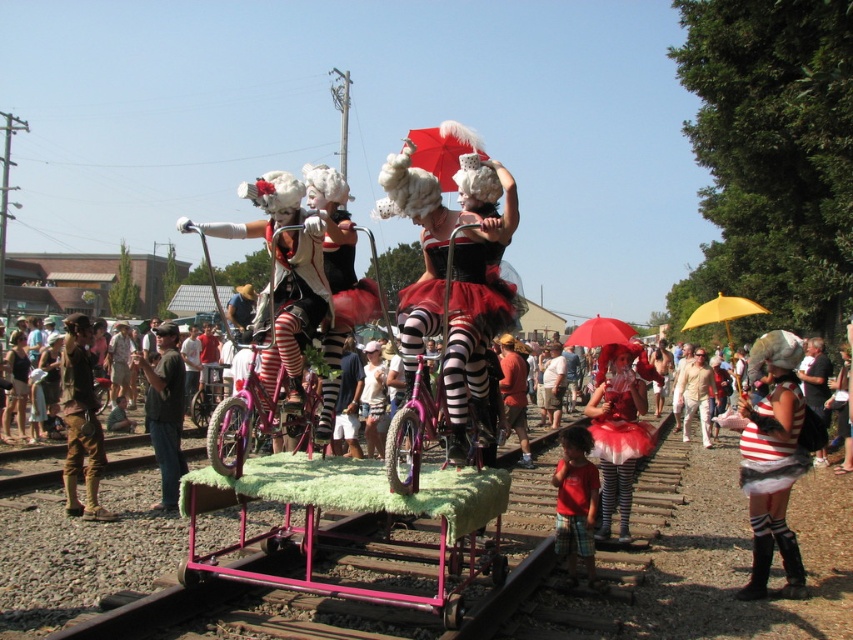
Question: Can you confirm if matte red tutu at center is positioned to the left of matte black tutu at center?

Choices:
 (A) yes
 (B) no

Answer: (B)

Question: Can you confirm if red cotton shirt at lower center is smaller than yellow matte umbrella at upper right?

Choices:
 (A) no
 (B) yes

Answer: (B)

Question: Which of the following is the closest to the observer?

Choices:
 (A) brown leather hat at center
 (B) matte red tutu at center

Answer: (B)

Question: Estimate the real-world distances between objects in this image. Which object is closer to the brown leather boots at lower left?

Choices:
 (A) matte black bicycle at center
 (B) brown leather hat at center
 (C) matte black tutu at center

Answer: (B)

Question: Is the position of matte black tutu at center less distant than that of red cotton shirt at lower center?

Choices:
 (A) no
 (B) yes

Answer: (B)

Question: Among these points, which one is farthest from the camera?

Choices:
 (A) (579, 456)
 (B) (99, 442)
 (C) (622, 408)
 (D) (601, 376)

Answer: (D)